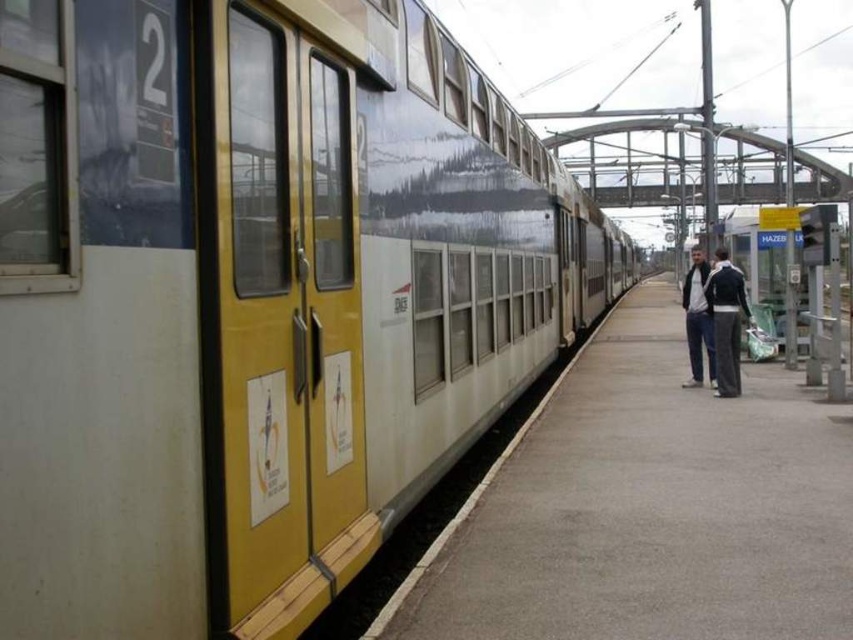
You are a passenger waiting at the train station. You see the smooth concrete platform at center and the dark blue jacket at center. Which object is closer to you?

The smooth concrete platform at center is closer to you because it is in front of the dark blue jacket at center.

You are a passenger waiting at platform 2 and want to board the train. There are two points marked on the platform where you can place your luggage. The first point is at point (x=737, y=384) and the second is at point (x=695, y=298). Which point is closer to you as you wait on the platform?

Point (x=737, y=384) is closer to the viewer than point (x=695, y=298), so the first point is closer to you as you wait on the platform.

You are a passenger waiting on the platform and want to board the train. You see the smooth concrete platform at center and the dark blue jeans at right. Which object is closer to you as you wait?

The smooth concrete platform at center is closer to you than the dark blue jeans at right.